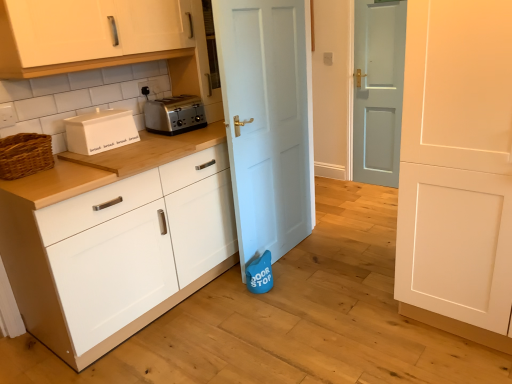
The height and width of the screenshot is (384, 512). Identify the location of vacant region under light blue matte door at center, acting as the second door starting from the front (from a real-world perspective). [x=292, y=246].